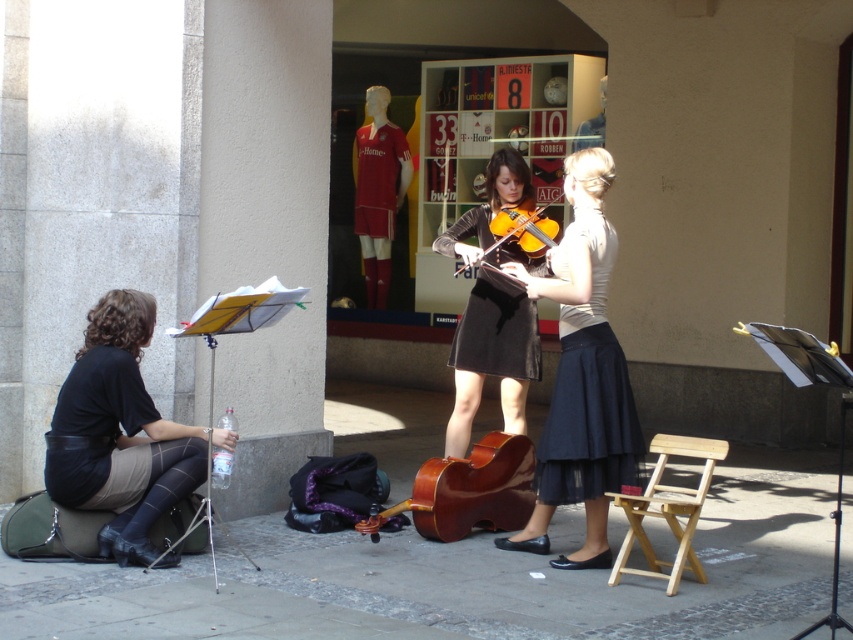
Based on the photo, you are standing at the center of the street and see the point marked at coordinates [120,435]. What object is located at that point?

The point at coordinates [120,435] corresponds to the black leather skirt at lower left.

You are a photographer trying to capture a shot of the wooden violin at center and the smooth leather jacket at upper center. Based on their positions, which object should you focus on first if you want to include both in your frame without moving the camera?

The wooden violin at center is to the left of the smooth leather jacket at upper center, so you should focus on the wooden violin at center first to ensure both are in frame without moving the camera.

You are a performer who needs to move from the light wood folding chair at lower right to the smooth leather jacket at upper center during your act. Can you walk directly between them without needing to detour around any obstacles?

The distance between the light wood folding chair at lower right and the smooth leather jacket at upper center is 6.53 meters, so yes, you can walk directly between them without needing to detour around any obstacles.